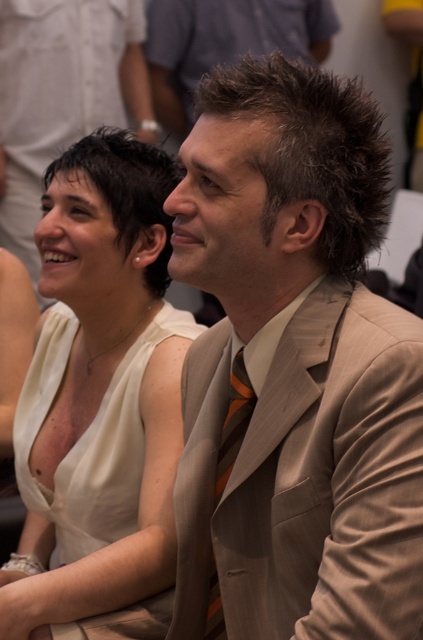
You are a photographer trying to capture a closeup of the dark brown spiky hair at upper center in the image. The camera you are using has a focal length of 50mm. To ensure the point at coordinates point (225, 42) is in focus, how should you adjust the camera settings?

The point at coordinates point (225, 42) is located on the dark brown spiky hair at upper center. To focus on this point with a 50mm lens, adjust the focus ring until the area around the dark brown spiky hair at upper center becomes sharp. Since the point is on the subject, ensure the focus point aligns with the dark brown spiky hair at upper center.

You are a photographer at a social event. You want to take a photo of the dark brown spiky hair at upper center and the orange striped tie at center. Which object should you focus on first if you want to capture both in a single frame without moving the camera?

You should focus on the dark brown spiky hair at upper center first because it has a larger size compared to the orange striped tie at center, ensuring it is in focus while the smaller object may still be within the depth of field.